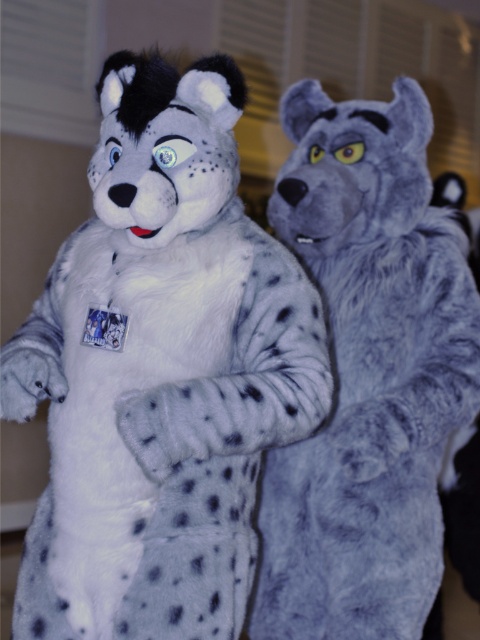
Measure the distance between white soft plush toy at center and fuzzy gray wolf at right.

16.28 inches

Is white soft plush toy at center taller than fuzzy gray wolf at right?

No, white soft plush toy at center is not taller than fuzzy gray wolf at right.

What are the coordinates of `white soft plush toy at center` in the screenshot? It's located at (160, 371).